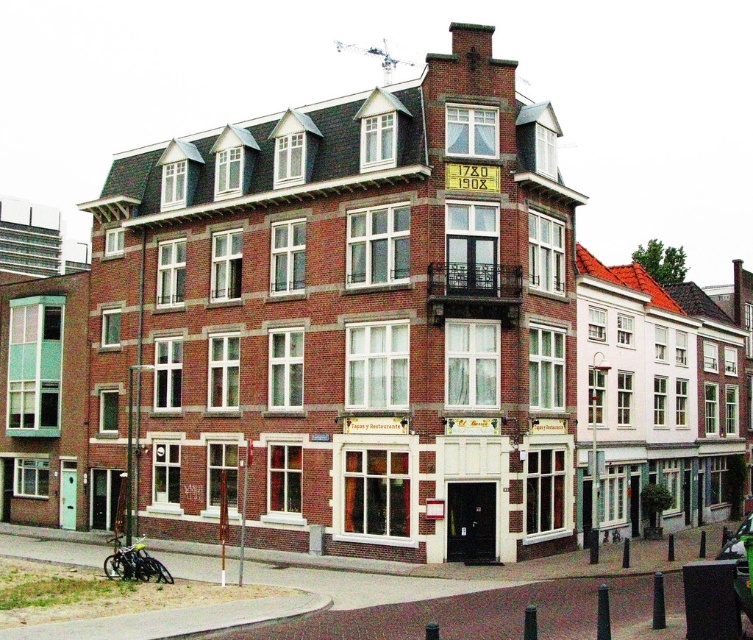
You are standing in front of the brick building at center. What are the coordinates of its location?

The brick building at center is located at coordinates point (343, 323).

Consider the image. You are a delivery person trying to park your delivery van, which is 2.5 meters wide, in front of the building. You see the metallic silver motorcycle at lower left and the metallic silver car at center parked there. Can you determine if there is enough space between them to park your van?

The metallic silver motorcycle at lower left is narrower than the metallic silver car at center, but the exact distance between them isn not specified. Without knowing the gap between the two vehicles, it is impossible to determine if there is sufficient space for the 2.5 meter wide van.